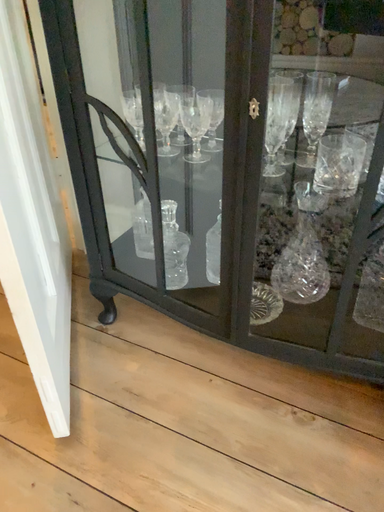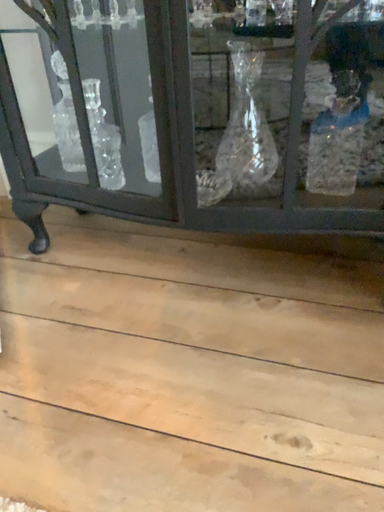
Question: How did the camera likely rotate when shooting the video?

Choices:
 (A) rotated left
 (B) rotated right

Answer: (B)